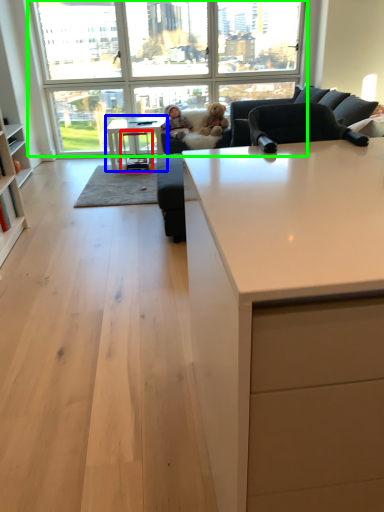
Question: Which object is positioned closest to stool (highlighted by a red box)? Select from table (highlighted by a blue box) and window (highlighted by a green box).

Choices:
 (A) table
 (B) window

Answer: (A)